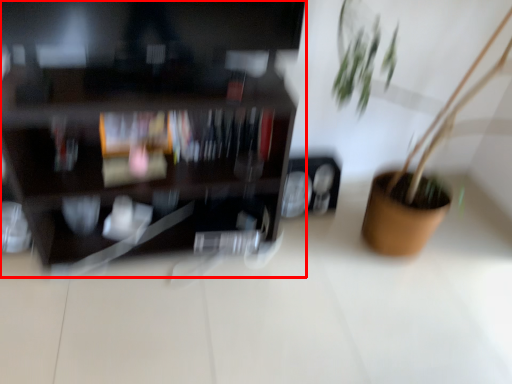
Question: Considering the relative positions of shelf (annotated by the red box) and houseplant in the image provided, where is shelf (annotated by the red box) located with respect to the staircase?

Choices:
 (A) right
 (B) left

Answer: (B)